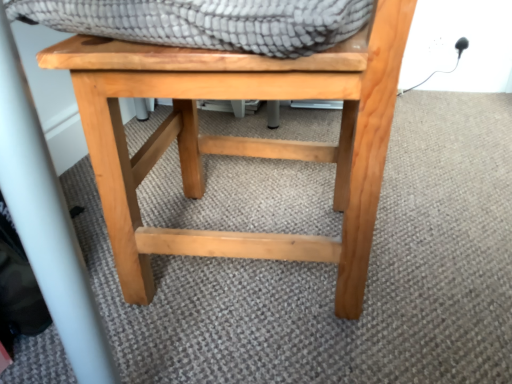
Question: From a real-world perspective, is textured gray blanket at upper center physically below natural wood stool at center?

Choices:
 (A) yes
 (B) no

Answer: (B)

Question: Does textured gray blanket at upper center lie behind natural wood stool at center?

Choices:
 (A) no
 (B) yes

Answer: (A)

Question: Is textured gray blanket at upper center not within natural wood stool at center?

Choices:
 (A) no
 (B) yes

Answer: (A)

Question: Does textured gray blanket at upper center have a lesser width compared to natural wood stool at center?

Choices:
 (A) no
 (B) yes

Answer: (B)

Question: Can you confirm if textured gray blanket at upper center is shorter than natural wood stool at center?

Choices:
 (A) no
 (B) yes

Answer: (B)

Question: From the image's perspective, is textured gray blanket at upper center beneath natural wood stool at center?

Choices:
 (A) yes
 (B) no

Answer: (B)

Question: Does natural wood stool at center appear on the right side of textured gray blanket at upper center?

Choices:
 (A) no
 (B) yes

Answer: (A)

Question: Does natural wood stool at center appear on the left side of textured gray blanket at upper center?

Choices:
 (A) yes
 (B) no

Answer: (A)

Question: Can you confirm if natural wood stool at center is shorter than textured gray blanket at upper center?

Choices:
 (A) no
 (B) yes

Answer: (A)

Question: Does natural wood stool at center have a larger size compared to textured gray blanket at upper center?

Choices:
 (A) yes
 (B) no

Answer: (A)

Question: From a real-world perspective, is natural wood stool at center below textured gray blanket at upper center?

Choices:
 (A) no
 (B) yes

Answer: (B)

Question: Is textured gray blanket at upper center inside natural wood stool at center?

Choices:
 (A) yes
 (B) no

Answer: (A)

Question: From a real-world perspective, relative to textured gray blanket at upper center, is natural wood stool at center vertically above or below?

Choices:
 (A) below
 (B) above

Answer: (A)